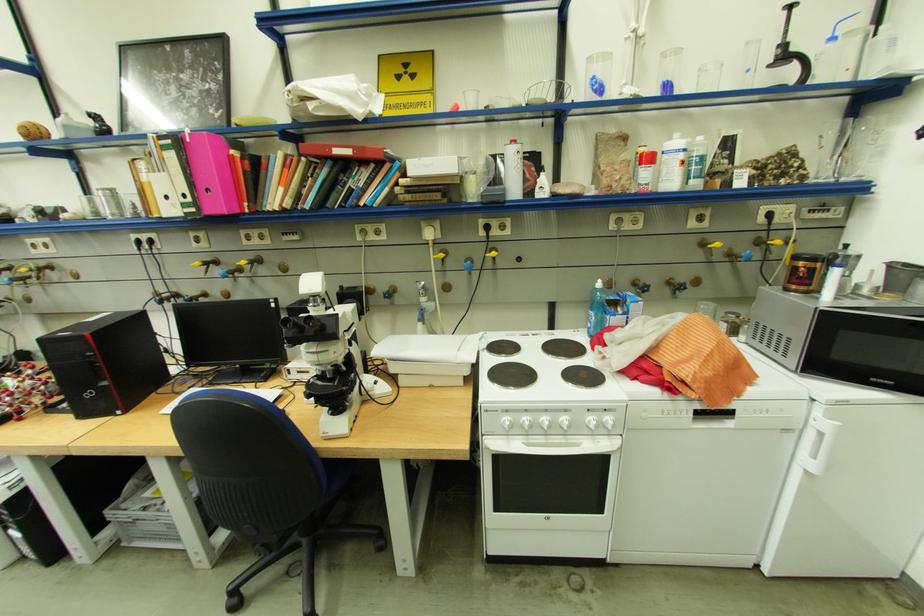
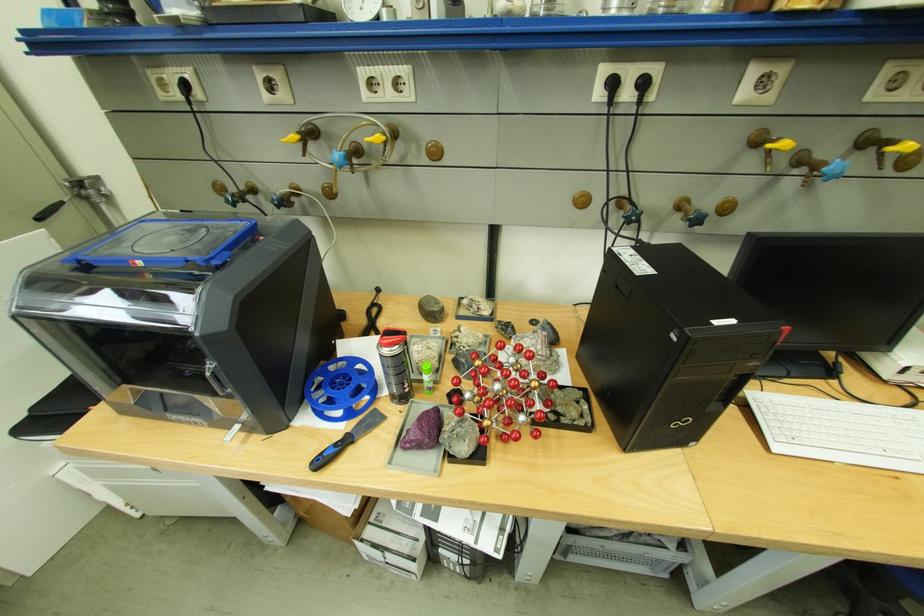
The point at (75,270) is marked in the first image. Where is the corresponding point in the second image?

(428, 140)